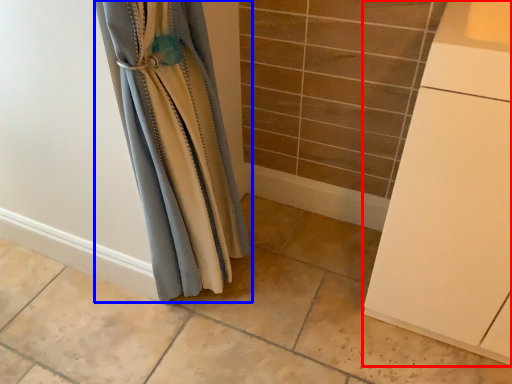
Question: Among these objects, which one is farthest to the camera, cabinetry (highlighted by a red box) or curtain (highlighted by a blue box)?

Choices:
 (A) cabinetry
 (B) curtain

Answer: (B)